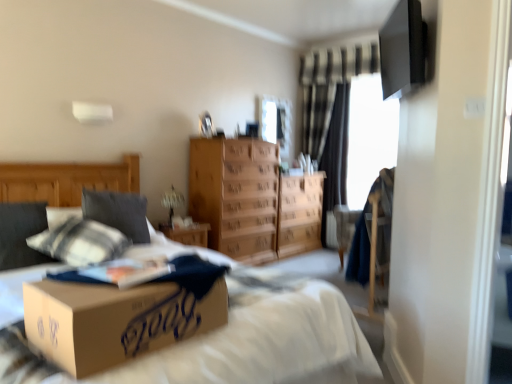
Question: From a real-world perspective, relative to clear glass window screen at upper center, marked as the 2th window screen in a right-to-left arrangement, is black textured curtain at center vertically above or below?

Choices:
 (A) above
 (B) below

Answer: (B)

Question: In terms of height, does black textured curtain at center look taller or shorter compared to clear glass window screen at upper center, the 1th window screen positioned from the left?

Choices:
 (A) short
 (B) tall

Answer: (B)

Question: Estimate the real-world distances between objects in this image. Which object is closer to the transparent glass window screen at upper right, the second window screen positioned from the left?

Choices:
 (A) soft gray pillow at left
 (B) clear glass window screen at upper center, marked as the 2th window screen in a right-to-left arrangement
 (C) brown cardboard box at center
 (D) light brown wood chest of drawers at center
 (E) black textured curtain at center

Answer: (E)

Question: Based on their relative distances, which object is farther from the light brown wood chest of drawers at center?

Choices:
 (A) brown cardboard box at center
 (B) soft gray pillow at left
 (C) wooden dresser at center
 (D) black textured curtain at center
 (E) transparent glass window screen at upper right, positioned as the 1th window screen in right-to-left order

Answer: (A)